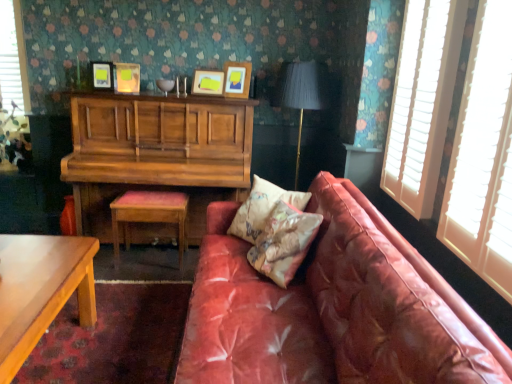
Locate an element on the screen. This screenshot has width=512, height=384. free space above smooth wooden table at lower left (from a real-world perspective) is located at coordinates click(x=27, y=278).